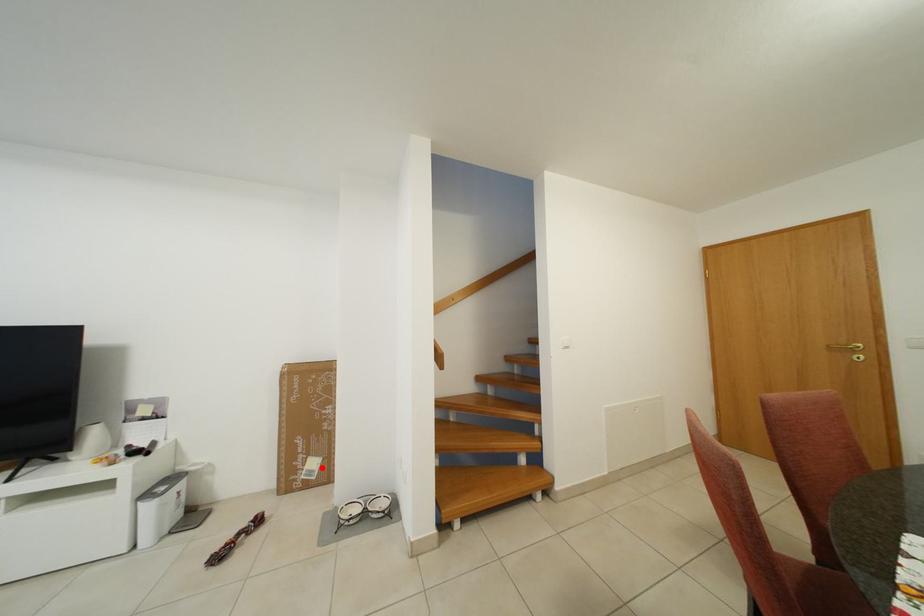
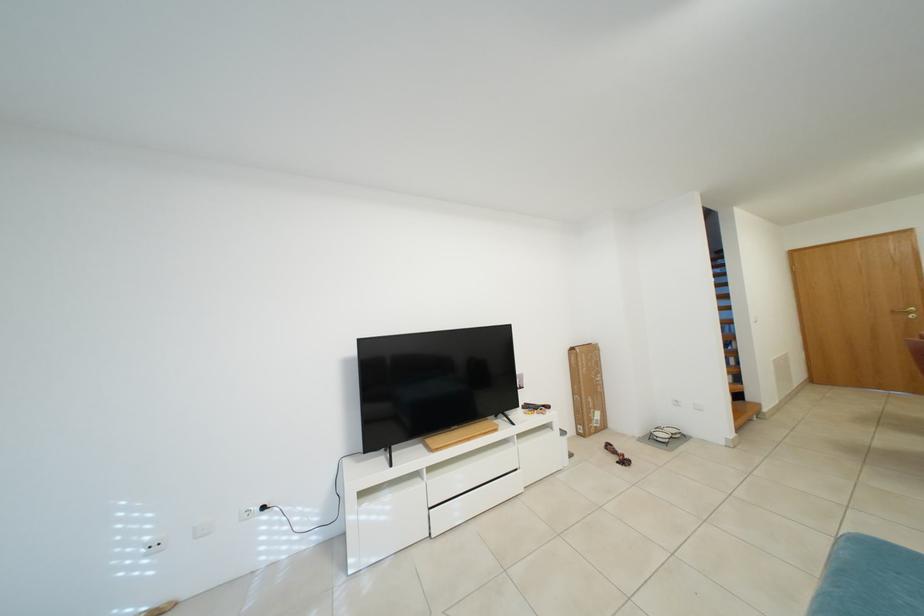
Question: I am providing you with two images of the same scene from different viewpoints. A red point is marked on the first image. At the location where the point appears in image 1, is it still visible in image 2?

Choices:
 (A) Yes
 (B) No

Answer: (A)